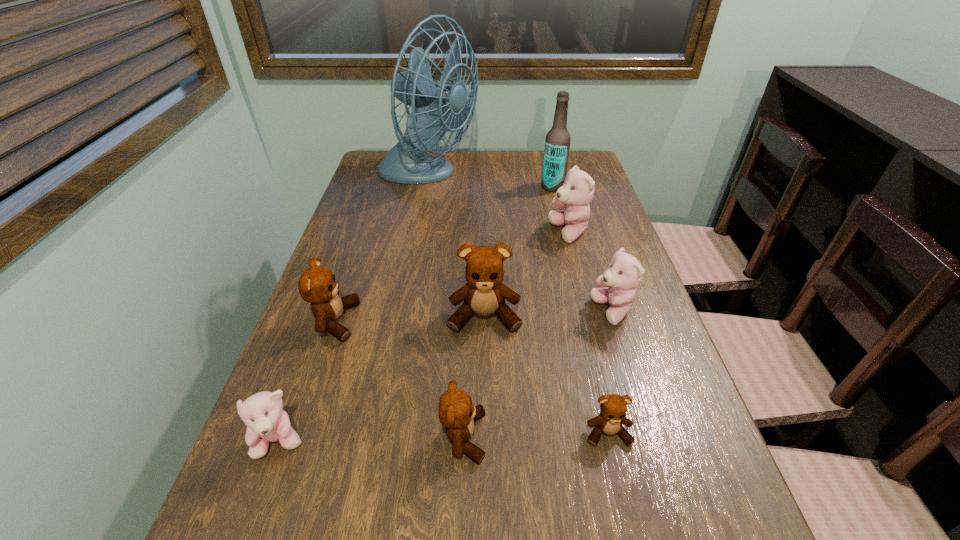
Identify the location of fan. (x=435, y=107).

The image size is (960, 540). I want to click on the eighth shortest object, so click(x=557, y=143).

Identify the location of the biggest pink teddy bear. This screenshot has height=540, width=960. (577, 192).

Find the location of `the farthest pink teddy bear`. the farthest pink teddy bear is located at coordinates (577, 192).

Locate an element on the screen. This screenshot has height=540, width=960. the biggest brown teddy bear is located at coordinates (484, 293).

The width and height of the screenshot is (960, 540). I want to click on the second smallest pink teddy bear, so click(x=624, y=273).

The image size is (960, 540). In order to click on the leftmost brown teddy bear in this screenshot , I will do `click(317, 285)`.

At what (x,y) coordinates should I click in order to perform the action: click on the second smallest brown teddy bear. Please return your answer as a coordinate pair (x, y). This screenshot has width=960, height=540. Looking at the image, I should click on (456, 412).

Find the location of `the smallest pink teddy bear`. the smallest pink teddy bear is located at coordinates (266, 421).

The height and width of the screenshot is (540, 960). Find the location of `the leftmost pink teddy bear`. the leftmost pink teddy bear is located at coordinates (266, 421).